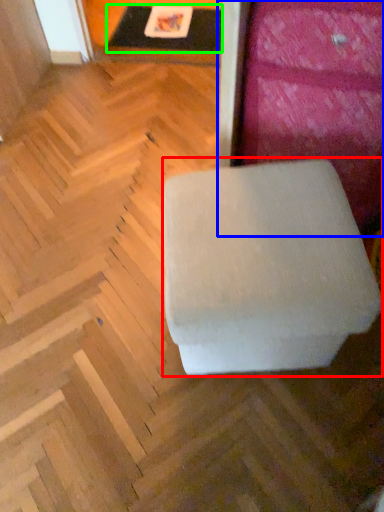
Question: Estimate the real-world distances between objects in this image. Which object is farther from furniture (highlighted by a red box), furniture (highlighted by a blue box) or table (highlighted by a green box)?

Choices:
 (A) furniture
 (B) table

Answer: (B)